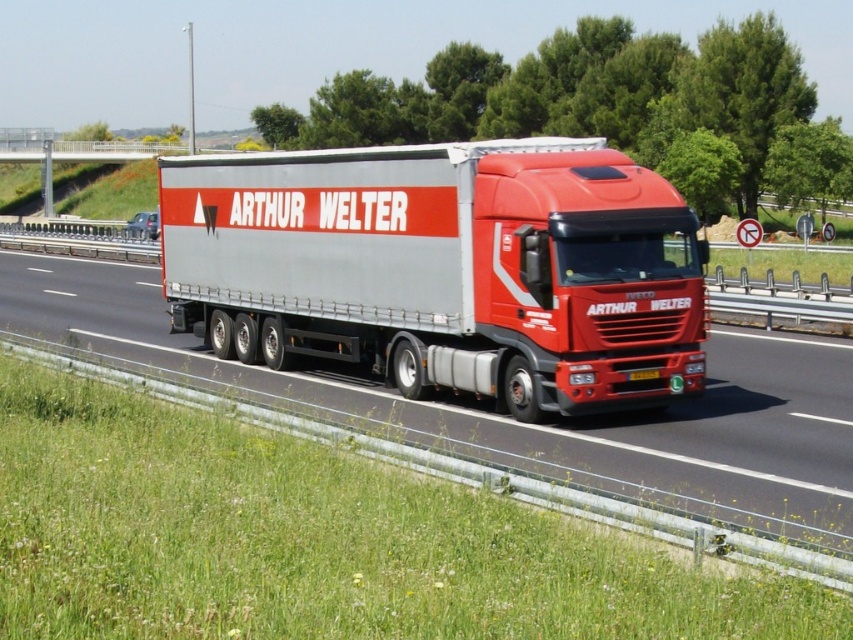
Is metallic silver trailer truck at center wider than red matte truck at center?

No.

Can you confirm if metallic silver trailer truck at center is taller than red matte truck at center?

Yes.

Is point (213, 332) behind point (148, 308)?

No, (213, 332) is closer to viewer.

Where is `metallic silver trailer truck at center`? This screenshot has width=853, height=640. metallic silver trailer truck at center is located at coordinates (445, 268).